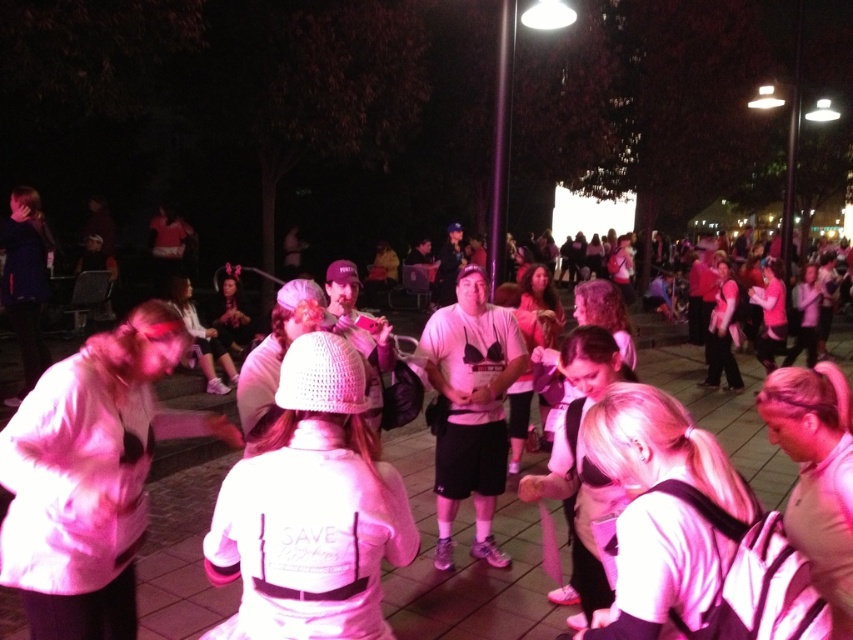
Question: Does white fuzzy jacket at lower left appear on the right side of white knitted hat at center?

Choices:
 (A) yes
 (B) no

Answer: (B)

Question: Which is farther from the white matte t-shirt at center?

Choices:
 (A) white matte jacket at center
 (B) white fuzzy jacket at lower left

Answer: (B)

Question: Can you confirm if white matte jacket at center is thinner than white matte t-shirt at center?

Choices:
 (A) yes
 (B) no

Answer: (B)

Question: Which point is closer to the camera taking this photo?

Choices:
 (A) (839, 362)
 (B) (283, 605)
 (C) (457, 403)
 (D) (54, 410)

Answer: (B)

Question: Which object is the closest to the white matte jacket at center?

Choices:
 (A) white matte t-shirt at center
 (B) white knitted hat at center

Answer: (A)

Question: Is white matte jacket at center bigger than white fuzzy jacket at lower left?

Choices:
 (A) no
 (B) yes

Answer: (B)